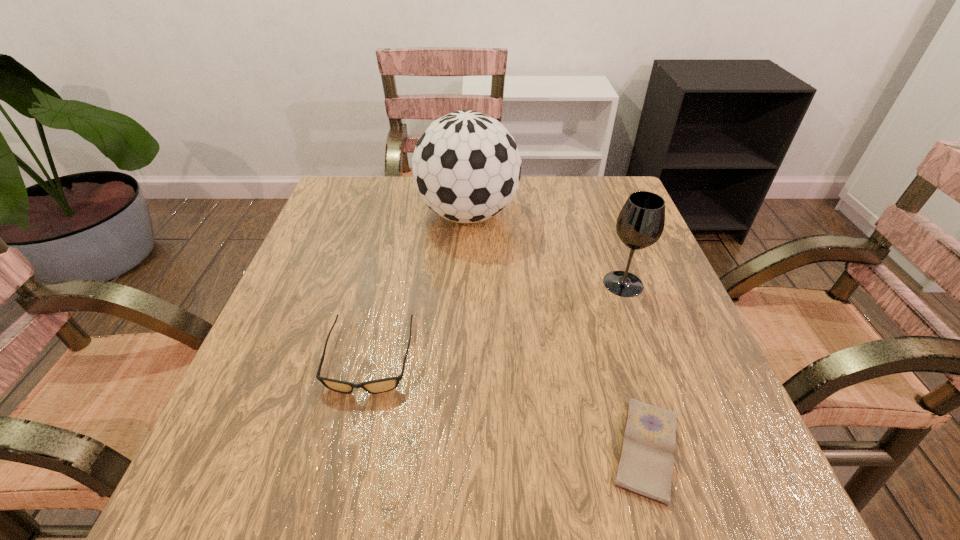
Find the location of a particular element. free space located on the front-facing side of the second shortest object is located at coordinates (353, 428).

This screenshot has height=540, width=960. Find the location of `free space located 0.120m on the back of the shortest object`. free space located 0.120m on the back of the shortest object is located at coordinates (615, 344).

The width and height of the screenshot is (960, 540). What are the coordinates of `object that is at the far edge` in the screenshot? It's located at (466, 166).

At what (x,y) coordinates should I click in order to perform the action: click on object that is at the near edge. Please return your answer as a coordinate pair (x, y). The image size is (960, 540). Looking at the image, I should click on (645, 468).

Image resolution: width=960 pixels, height=540 pixels. Find the location of `object positioned at the left edge`. object positioned at the left edge is located at coordinates (387, 384).

The height and width of the screenshot is (540, 960). What are the coordinates of `wineglass at the right edge` in the screenshot? It's located at (640, 223).

Identify the location of diary located at the right edge. (645, 468).

Where is `object at the near right corner`? The image size is (960, 540). object at the near right corner is located at coordinates (645, 468).

I want to click on free spot at the far edge of the desktop, so click(x=416, y=207).

In the image, there is a desktop. Identify the location of vacant space at the near edge. Image resolution: width=960 pixels, height=540 pixels. (544, 495).